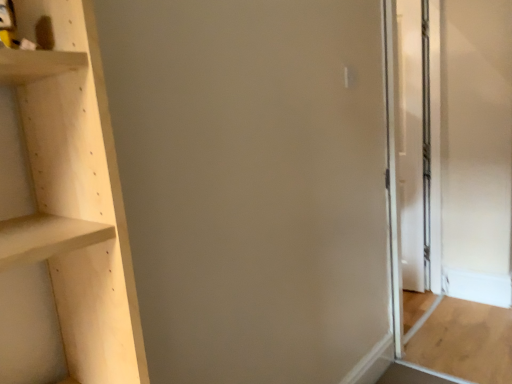
Where is `empty space that is ontop of light brown wood door at right (from a real-world perspective)`? The height and width of the screenshot is (384, 512). empty space that is ontop of light brown wood door at right (from a real-world perspective) is located at coordinates (480, 325).